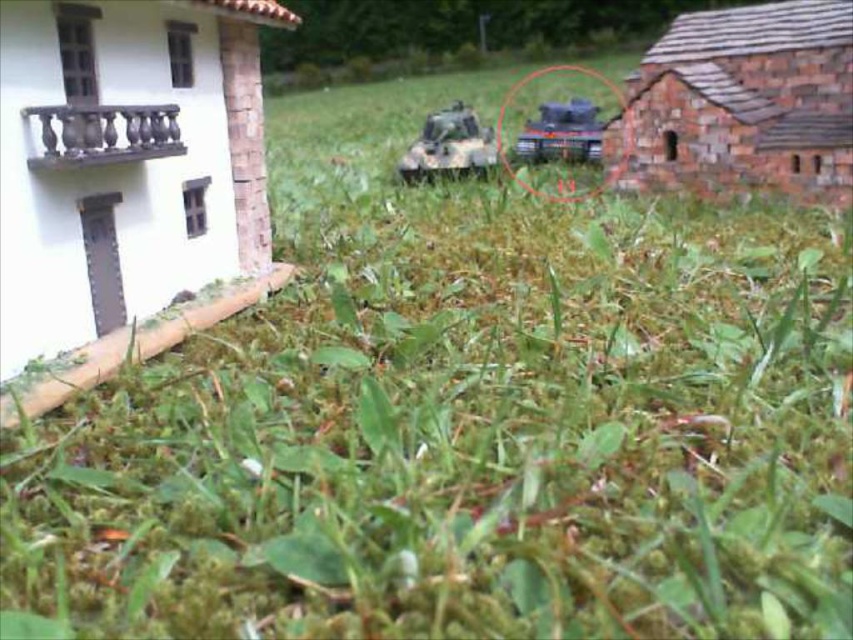
You are a drone operator trying to navigate between two points in the miniature diorama scene. The first point is at coordinate point [474,124] and the second is at point [529,147]. Which point is closer to you as you look at the scene?

Point [474,124] is closer to the viewer than point [529,147].

You are a military planner analyzing this miniature battlefield. You need to determine the best position for a new supply depot. Considering the positions of the camouflage plastic tank at center and the brushed metal tank at center, which tank is closer to the ground and why?

The camouflage plastic tank at center is closer to the ground because it is positioned below the brushed metal tank at center.

Consider the image. You are a toy collector examining the diorama. You want to know which tank, the camouflage plastic tank at center or the brushed metal tank at center, is taller. Can you tell me?

The camouflage plastic tank at center is much taller than the brushed metal tank at center.